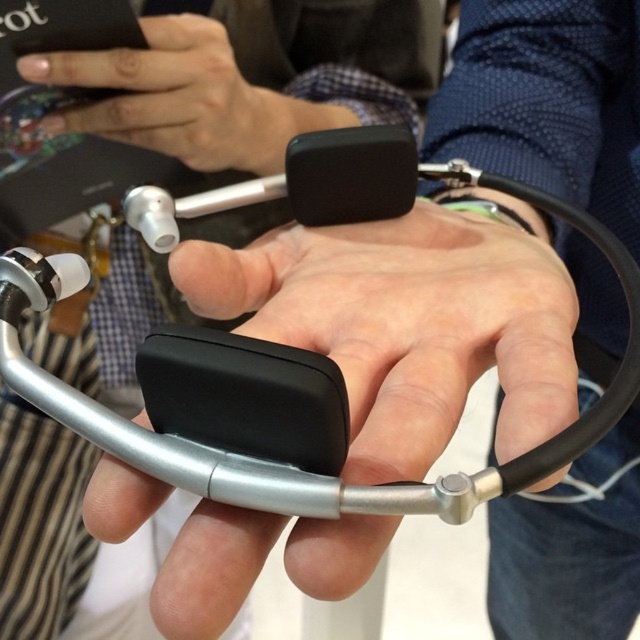
Who is higher up, black matte stethoscope at center or black matte earbud at center?

black matte earbud at center is above.

Is black matte stethoscope at center bigger than black matte earbud at center?

Incorrect, black matte stethoscope at center is not larger than black matte earbud at center.

Is point (355, 292) positioned in front of point (90, 563)?

Yes, point (355, 292) is closer to viewer.

Locate an element on the screen. black matte stethoscope at center is located at coordinates (410, 321).

Is point (490, 266) behind point (52, 115)?

No, it is not.

Which is behind, point (209, 257) or point (49, 67)?

Positioned behind is point (49, 67).

Locate an element on the screen. This screenshot has width=640, height=640. black matte stethoscope at center is located at coordinates (410, 321).

Is black matte earbud at center positioned at the back of matte black phone at upper left?

That is True.

Looking at this image, measure the distance from black matte earbud at center to matte black phone at upper left.

black matte earbud at center and matte black phone at upper left are 9.80 centimeters apart.

Where is `black matte earbud at center`? This screenshot has height=640, width=640. black matte earbud at center is located at coordinates (237, 80).